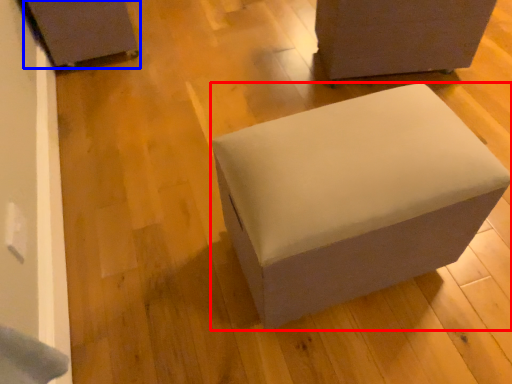
Question: Among these objects, which one is nearest to the camera, furniture (highlighted by a red box) or furniture (highlighted by a blue box)?

Choices:
 (A) furniture
 (B) furniture

Answer: (A)